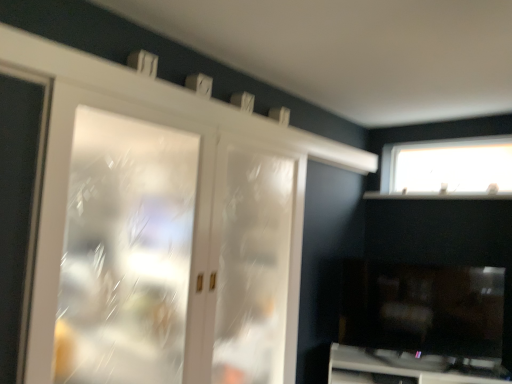
Question: Considering their positions, is white frosted glass screen door at left, the second screen door positioned from the back, located in front of or behind white glossy cabinet at lower right?

Choices:
 (A) front
 (B) behind

Answer: (A)

Question: Is white frosted glass screen door at left, the first screen door in the left-to-right sequence, to the left or to the right of white glossy cabinet at lower right in the image?

Choices:
 (A) left
 (B) right

Answer: (A)

Question: Which object is positioned closest to the white frosted glass screen door at left, the second screen door positioned from the right?

Choices:
 (A) clear glass door at center, the 2th screen door in the left-to-right sequence
 (B) white glossy cabinet at lower right
 (C) transparent glass window at upper right

Answer: (A)

Question: Considering the real-world distances, which object is closest to the white frosted glass screen door at left, the second screen door positioned from the right?

Choices:
 (A) white glossy cabinet at lower right
 (B) transparent glass window at upper right
 (C) clear glass door at center, the first screen door in the right-to-left sequence

Answer: (C)